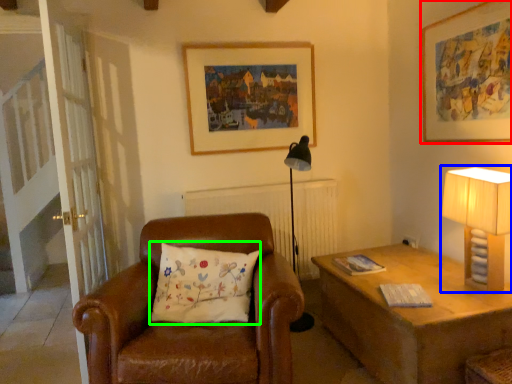
Question: Estimate the real-world distances between objects in this image. Which object is closer to picture frame (highlighted by a red box), table lamp (highlighted by a blue box) or pillow (highlighted by a green box)?

Choices:
 (A) table lamp
 (B) pillow

Answer: (A)